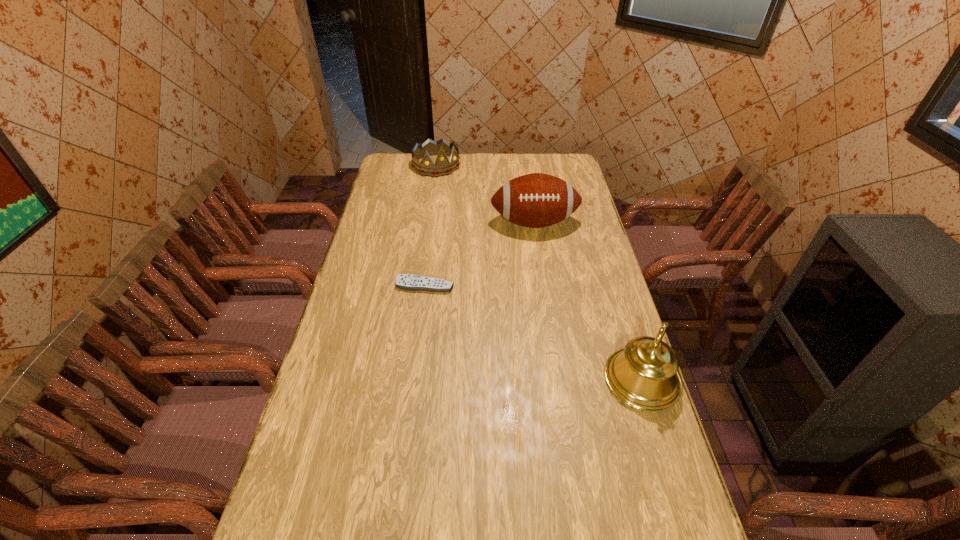
Find the location of a particular element. free space on the desktop that is between the shortest object and the bell and is positioned at the front of the tiara with jewels is located at coordinates (540, 336).

The width and height of the screenshot is (960, 540). What are the coordinates of `free spot on the desktop that is between the remote control and the nearest object and is positioned on the laces of the football` in the screenshot? It's located at 554,342.